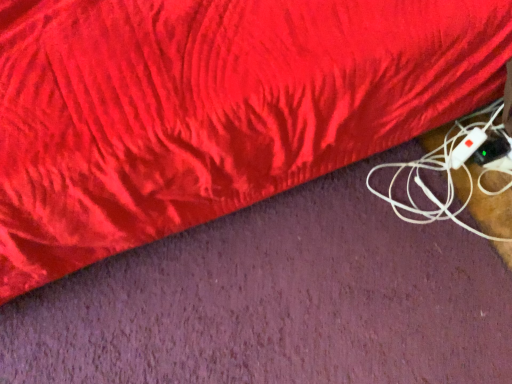
Image resolution: width=512 pixels, height=384 pixels. Describe the element at coordinates (467, 147) in the screenshot. I see `white plastic game controller at lower right` at that location.

Where is `white plastic game controller at lower right`? This screenshot has height=384, width=512. white plastic game controller at lower right is located at coordinates (467, 147).

Where is `white plastic game controller at lower right`? The height and width of the screenshot is (384, 512). white plastic game controller at lower right is located at coordinates (467, 147).